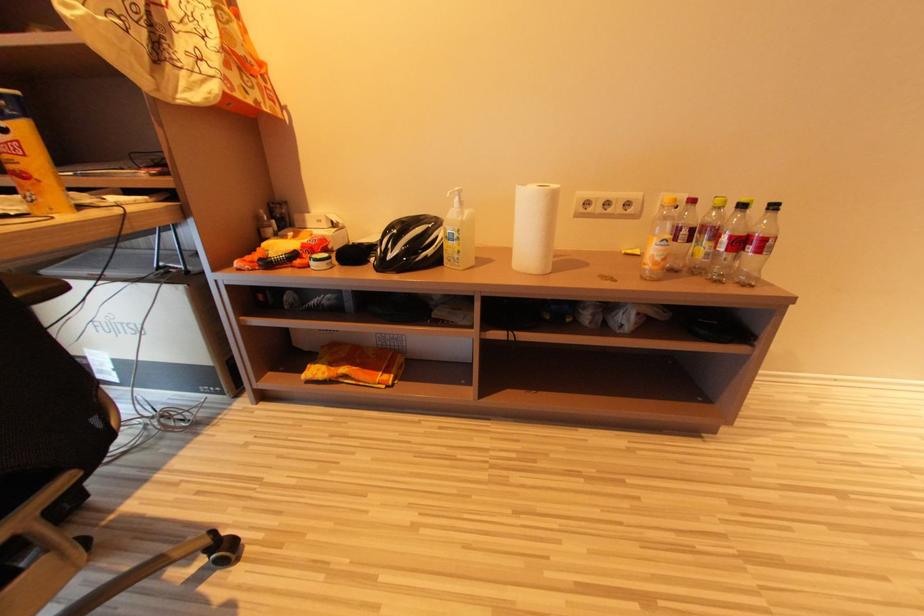
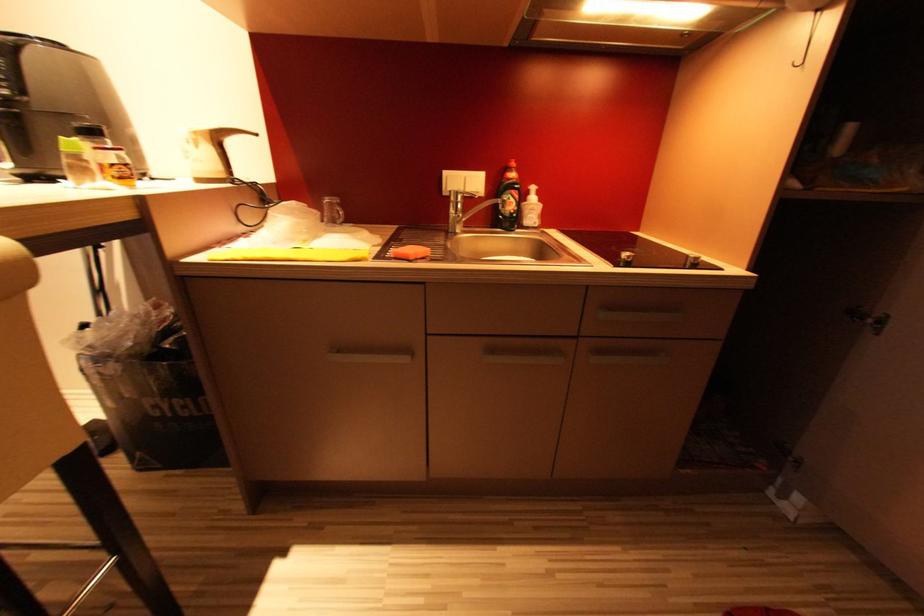
Question: What movement of the cameraman would produce the second image?

Choices:
 (A) Left
 (B) Right
 (C) Forward
 (D) Backward

Answer: (B)